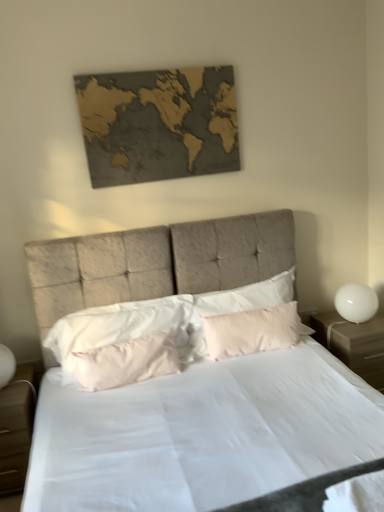
Find the location of a particular element. empty space that is ontop of gold textured map at upper center (from a real-world perspective) is located at coordinates (148, 67).